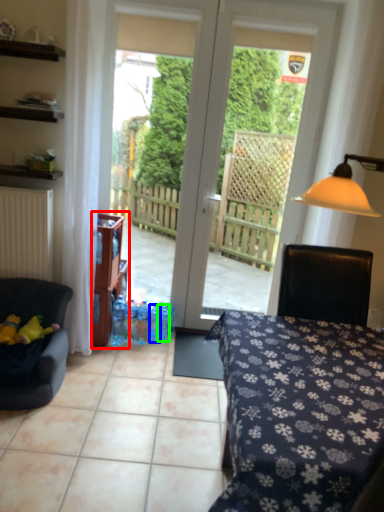
Question: Estimate the real-world distances between objects in this image. Which object is farther from shelf (highlighted by a red box), bottle (highlighted by a blue box) or bottle (highlighted by a green box)?

Choices:
 (A) bottle
 (B) bottle

Answer: (B)